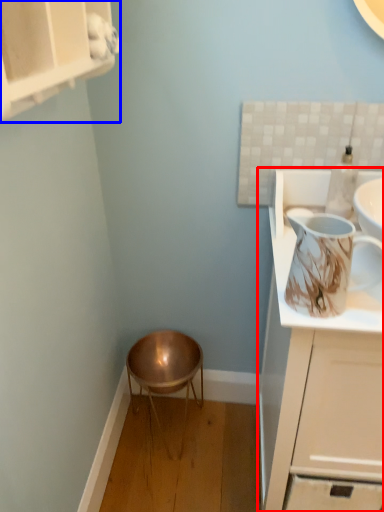
Question: Which object appears farthest to the camera in this image, cabinetry (highlighted by a red box) or cabinetry (highlighted by a blue box)?

Choices:
 (A) cabinetry
 (B) cabinetry

Answer: (A)